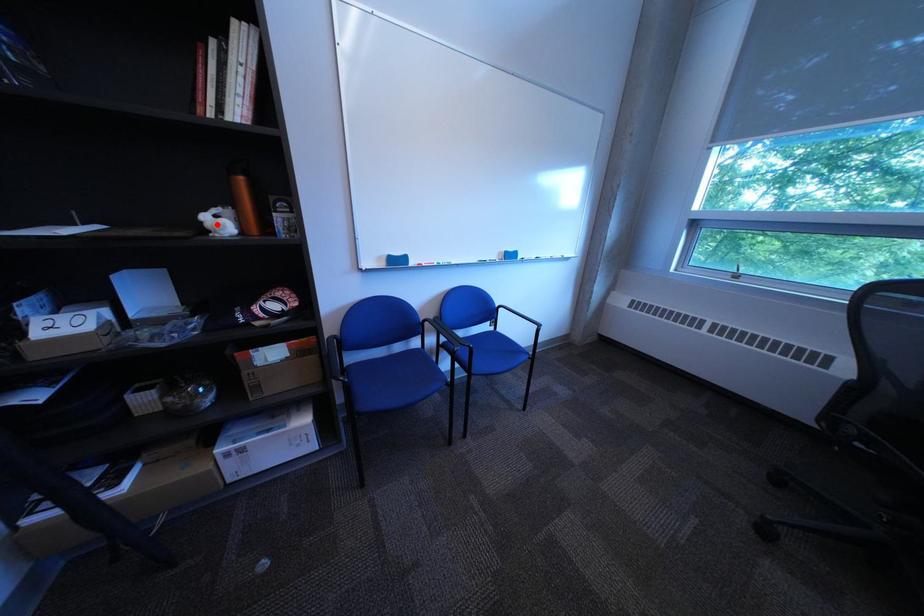
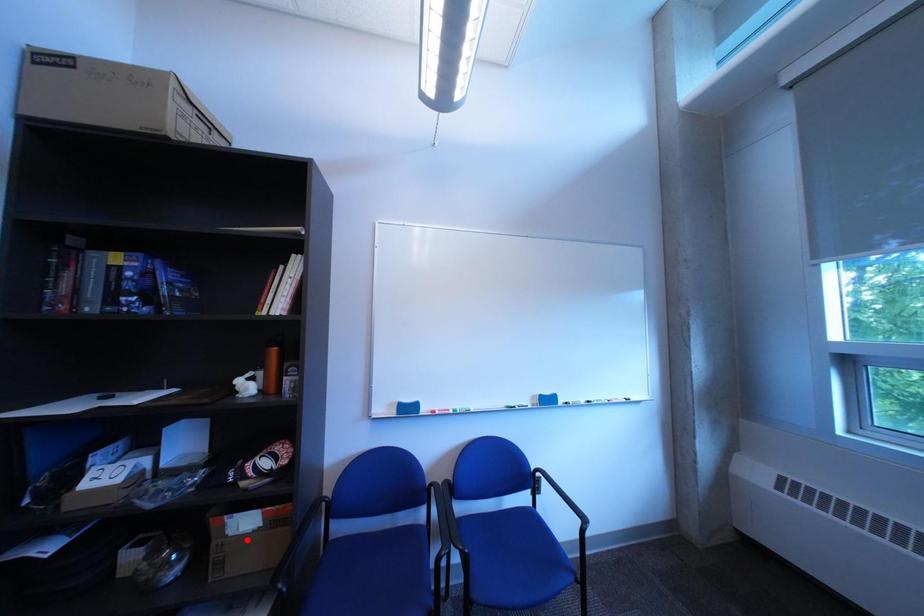
I am providing you with two images of the same scene from different viewpoints. A red point is marked on the first image and another point is marked on the second image. Are the points marked in image1 and image2 representing the same 3D position?

No